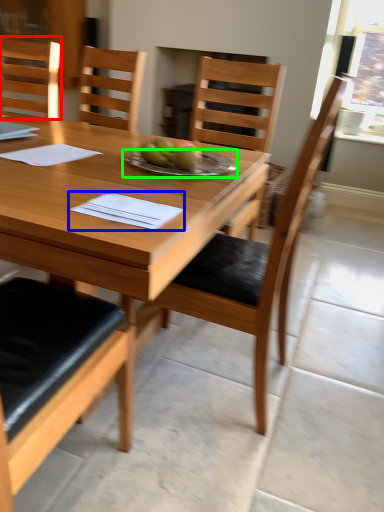
Question: Considering the real-world distances, which object is farthest from chair (highlighted by a red box)? notebook (highlighted by a blue box) or plate (highlighted by a green box)?

Choices:
 (A) notebook
 (B) plate

Answer: (A)